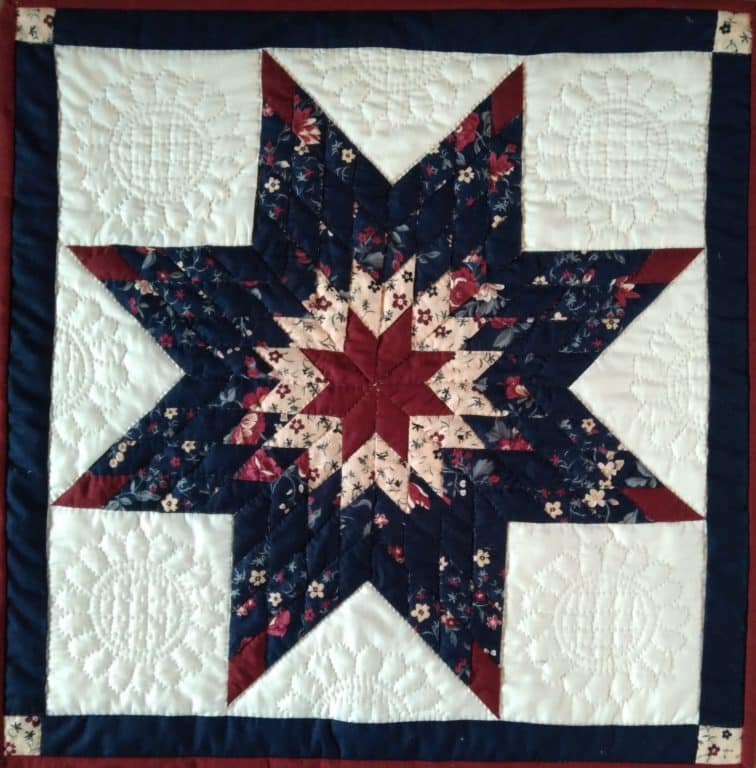
Locate an element on the screen. The width and height of the screenshot is (756, 768). blanket is located at coordinates (403, 80).